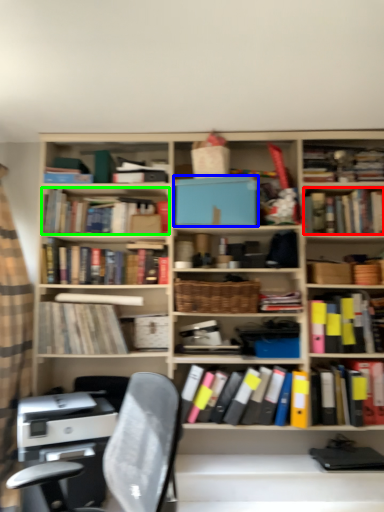
Question: Estimate the real-world distances between objects in this image. Which object is farther from book (highlighted by a red box), paperback book (highlighted by a blue box) or book (highlighted by a green box)?

Choices:
 (A) paperback book
 (B) book

Answer: (B)